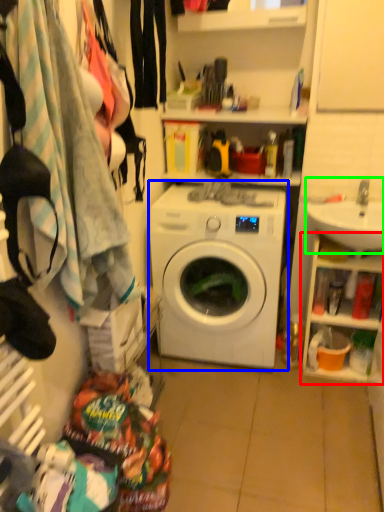
Question: Considering the real-world distances, which object is closest to cabinet (highlighted by a red box)? washing machine (highlighted by a blue box) or sink (highlighted by a green box).

Choices:
 (A) washing machine
 (B) sink

Answer: (B)